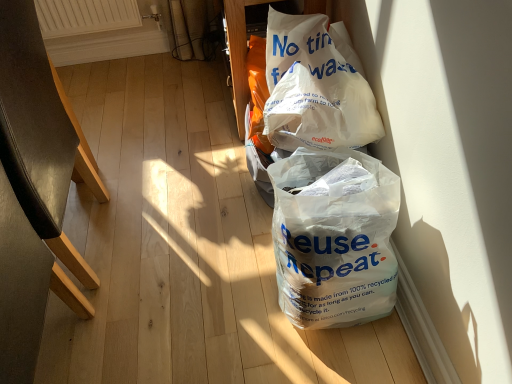
In the scene shown: What is the approximate height of white textured radiator at upper left?

It is 10.86 inches.

The width and height of the screenshot is (512, 384). I want to click on white textured radiator at upper left, so click(85, 16).

Find the location of a particular element. The height and width of the screenshot is (384, 512). black leather chair at left is located at coordinates (41, 135).

Describe the element at coordinates (315, 88) in the screenshot. The image size is (512, 384). I see `white paper bag at upper right, acting as the second plastic bag starting from the bottom` at that location.

The height and width of the screenshot is (384, 512). Find the location of `white textured radiator at upper left`. white textured radiator at upper left is located at coordinates (85, 16).

From the image's perspective, between white paper bag at upper right, the 1th plastic bag in the top-to-bottom sequence, and black leather chair at left, who is located below?

black leather chair at left, from the image's perspective.

From a real-world perspective, which is physically above, white paper bag at upper right, acting as the second plastic bag starting from the bottom, or black leather chair at left?

white paper bag at upper right, acting as the second plastic bag starting from the bottom.

Between point (284, 90) and point (57, 125), which one is positioned behind?

Positioned behind is point (57, 125).

From a real-world perspective, does white textured radiator at upper left sit lower than black leather chair at left?

Correct, in the physical world, white textured radiator at upper left is lower than black leather chair at left.

Between white textured radiator at upper left and black leather chair at left, which one is positioned behind?

Positioned behind is white textured radiator at upper left.

Which object is thinner, white textured radiator at upper left or black leather chair at left?

white textured radiator at upper left is thinner.

This screenshot has height=384, width=512. What are the coordinates of `furniture that appears in front of the white paper bag at upper right, the 1th plastic bag in the top-to-bottom sequence` in the screenshot? It's located at (41, 135).

Considering the sizes of black leather chair at left and white paper bag at upper right, the 1th plastic bag in the top-to-bottom sequence, in the image, is black leather chair at left wider or thinner than white paper bag at upper right, the 1th plastic bag in the top-to-bottom sequence,?

Considering their sizes, black leather chair at left looks broader than white paper bag at upper right, the 1th plastic bag in the top-to-bottom sequence.

From the image's perspective, is black leather chair at left positioned above or below white paper bag at upper right, acting as the second plastic bag starting from the bottom?

From the image's perspective, black leather chair at left appears below white paper bag at upper right, acting as the second plastic bag starting from the bottom.

Considering the sizes of objects white plastic bag at lower right, the second plastic bag in the top-to-bottom sequence, and white paper bag at upper right, acting as the second plastic bag starting from the bottom, in the image provided, who is thinner, white plastic bag at lower right, the second plastic bag in the top-to-bottom sequence, or white paper bag at upper right, acting as the second plastic bag starting from the bottom,?

With smaller width is white paper bag at upper right, acting as the second plastic bag starting from the bottom.

From a real-world perspective, who is located lower, white plastic bag at lower right, arranged as the first plastic bag when ordered from the bottom, or white paper bag at upper right, acting as the second plastic bag starting from the bottom?

white plastic bag at lower right, arranged as the first plastic bag when ordered from the bottom.

Is white plastic bag at lower right, arranged as the first plastic bag when ordered from the bottom, oriented towards white paper bag at upper right, acting as the second plastic bag starting from the bottom?

No.

Does white plastic bag at lower right, the second plastic bag in the top-to-bottom sequence, touch white paper bag at upper right, the 1th plastic bag in the top-to-bottom sequence?

There is a gap between white plastic bag at lower right, the second plastic bag in the top-to-bottom sequence, and white paper bag at upper right, the 1th plastic bag in the top-to-bottom sequence.

From the image's perspective, is white paper bag at upper right, acting as the second plastic bag starting from the bottom, positioned above or below white plastic bag at lower right, arranged as the first plastic bag when ordered from the bottom?

white paper bag at upper right, acting as the second plastic bag starting from the bottom, is situated higher than white plastic bag at lower right, arranged as the first plastic bag when ordered from the bottom, in the image.

Is point (336, 84) less distant than point (298, 254)?

No.

Consider the image. Who is smaller, white paper bag at upper right, the 1th plastic bag in the top-to-bottom sequence, or white plastic bag at lower right, the second plastic bag in the top-to-bottom sequence?

white paper bag at upper right, the 1th plastic bag in the top-to-bottom sequence.

Can white plastic bag at lower right, the second plastic bag in the top-to-bottom sequence, be found inside white paper bag at upper right, acting as the second plastic bag starting from the bottom?

That's incorrect, white plastic bag at lower right, the second plastic bag in the top-to-bottom sequence, is not inside white paper bag at upper right, acting as the second plastic bag starting from the bottom.

From a real-world perspective, does white plastic bag at lower right, the second plastic bag in the top-to-bottom sequence, sit lower than black leather chair at left?

Yes, from a real-world perspective, white plastic bag at lower right, the second plastic bag in the top-to-bottom sequence, is under black leather chair at left.

Considering the sizes of objects white plastic bag at lower right, the second plastic bag in the top-to-bottom sequence, and black leather chair at left in the image provided, who is thinner, white plastic bag at lower right, the second plastic bag in the top-to-bottom sequence, or black leather chair at left?

With smaller width is white plastic bag at lower right, the second plastic bag in the top-to-bottom sequence.

Is point (364, 317) closer to viewer compared to point (42, 85)?

Yes, point (364, 317) is in front of point (42, 85).

Could you tell me if white plastic bag at lower right, the second plastic bag in the top-to-bottom sequence, is turned towards black leather chair at left?

Yes, white plastic bag at lower right, the second plastic bag in the top-to-bottom sequence, is facing black leather chair at left.

Looking at this image, how distant is white textured radiator at upper left from white plastic bag at lower right, the second plastic bag in the top-to-bottom sequence?

The distance of white textured radiator at upper left from white plastic bag at lower right, the second plastic bag in the top-to-bottom sequence, is 1.54 meters.

Starting from the white textured radiator at upper left, which plastic bag is the 2nd one in front? Please provide its 2D coordinates.

[(334, 239)]

Between point (86, 20) and point (361, 171), which one is positioned in front?

The point (361, 171) is more forward.

Would you say white textured radiator at upper left is to the left or to the right of white plastic bag at lower right, arranged as the first plastic bag when ordered from the bottom, in the picture?

Based on their positions, white textured radiator at upper left is located to the left of white plastic bag at lower right, arranged as the first plastic bag when ordered from the bottom.

The image size is (512, 384). In the image, there is a white paper bag at upper right, the 1th plastic bag in the top-to-bottom sequence. Identify the location of furniture below it (from the image's perspective). (41, 135).

At what (x,y) coordinates should I click in order to perform the action: click on radiator above the black leather chair at left (from the image's perspective). Please return your answer as a coordinate pair (x, y). Looking at the image, I should click on (85, 16).

Which object lies nearer to the anchor point white textured radiator at upper left, white plastic bag at lower right, arranged as the first plastic bag when ordered from the bottom, or white paper bag at upper right, the 1th plastic bag in the top-to-bottom sequence?

white paper bag at upper right, the 1th plastic bag in the top-to-bottom sequence, is positioned closer to the anchor white textured radiator at upper left.

Estimate the real-world distances between objects in this image. Which object is further from white paper bag at upper right, the 1th plastic bag in the top-to-bottom sequence, white textured radiator at upper left or black leather chair at left?

white textured radiator at upper left is further to white paper bag at upper right, the 1th plastic bag in the top-to-bottom sequence.

Which object lies further to the anchor point white plastic bag at lower right, arranged as the first plastic bag when ordered from the bottom, white paper bag at upper right, acting as the second plastic bag starting from the bottom, or black leather chair at left?

The object further to white plastic bag at lower right, arranged as the first plastic bag when ordered from the bottom, is black leather chair at left.

Which object lies nearer to the anchor point white plastic bag at lower right, the second plastic bag in the top-to-bottom sequence, black leather chair at left or white paper bag at upper right, the 1th plastic bag in the top-to-bottom sequence?

white paper bag at upper right, the 1th plastic bag in the top-to-bottom sequence, is positioned closer to the anchor white plastic bag at lower right, the second plastic bag in the top-to-bottom sequence.

Which object lies nearer to the anchor point white textured radiator at upper left, white plastic bag at lower right, arranged as the first plastic bag when ordered from the bottom, or black leather chair at left?

black leather chair at left lies closer to white textured radiator at upper left than the other object.

Looking at the image, which one is located further to white plastic bag at lower right, arranged as the first plastic bag when ordered from the bottom, white textured radiator at upper left or white paper bag at upper right, the 1th plastic bag in the top-to-bottom sequence?

Based on the image, white textured radiator at upper left appears to be further to white plastic bag at lower right, arranged as the first plastic bag when ordered from the bottom.

Considering their positions, is white paper bag at upper right, acting as the second plastic bag starting from the bottom, positioned further to white plastic bag at lower right, the second plastic bag in the top-to-bottom sequence, than white textured radiator at upper left?

white textured radiator at upper left is positioned further to the anchor white plastic bag at lower right, the second plastic bag in the top-to-bottom sequence.

Looking at the image, which one is located further to white textured radiator at upper left, white paper bag at upper right, acting as the second plastic bag starting from the bottom, or black leather chair at left?

white paper bag at upper right, acting as the second plastic bag starting from the bottom, is further to white textured radiator at upper left.

The image size is (512, 384). I want to click on plastic bag between black leather chair at left and white plastic bag at lower right, the second plastic bag in the top-to-bottom sequence, so click(x=315, y=88).

Locate an element on the screen. The height and width of the screenshot is (384, 512). plastic bag between white plastic bag at lower right, arranged as the first plastic bag when ordered from the bottom, and white textured radiator at upper left in the front-back direction is located at coordinates (315, 88).